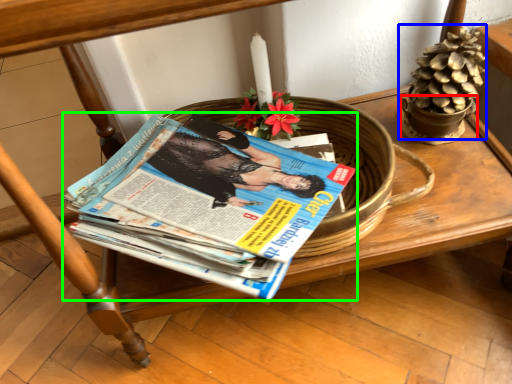
Question: Considering the real-world distances, which object is closest to flowerpot (highlighted by a red box)? flower basket (highlighted by a blue box) or book (highlighted by a green box).

Choices:
 (A) flower basket
 (B) book

Answer: (A)